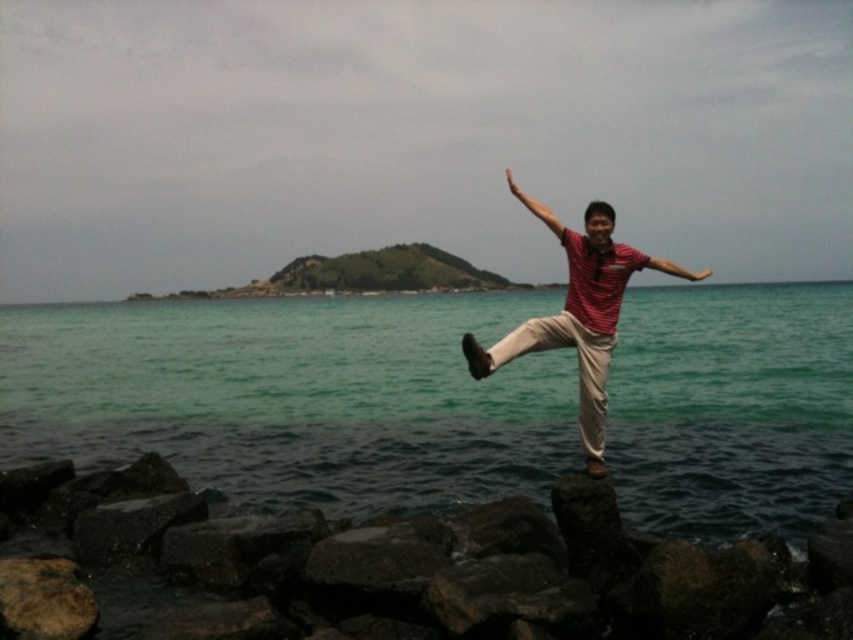
You are standing on the dark gray rock at lower center and want to jump into the green water at center. Based on the scene description, will your jump reach the water?

The green water at center is much taller than the dark gray rock at lower center, so yes, jumping from the dark gray rock at lower center will reach the green water at center since it is higher up.

You are a photographer trying to capture the person jumping in the scene. Based on the image, can you determine if the red striped shirt at center is above or below the green water at center?

The red striped shirt at center is below the green water at center because the green water at center is positioned over it.

Looking at this image, you are standing at the rocky shoreline in the image and want to reach the point marked at coordinates (294, 396). Based on the scene description, what type of terrain will you encounter when you arrive there?

The point at coordinates (294, 396) is on green water at center, so the terrain there is water.